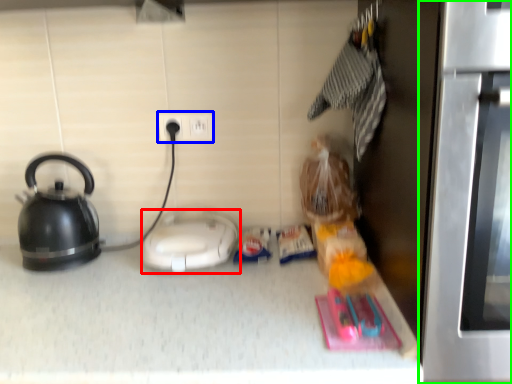
Question: Which object is the closest to the appliance (highlighted by a red box)? Choose among these: electric outlet (highlighted by a blue box) or oven (highlighted by a green box).

Choices:
 (A) electric outlet
 (B) oven

Answer: (A)